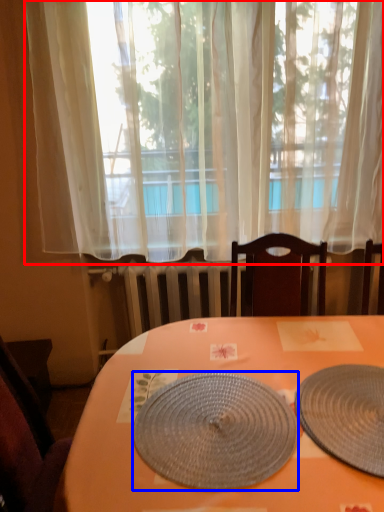
Question: Which of the following is the closest to the observer, curtain (highlighted by a red box) or plate (highlighted by a blue box)?

Choices:
 (A) curtain
 (B) plate

Answer: (B)